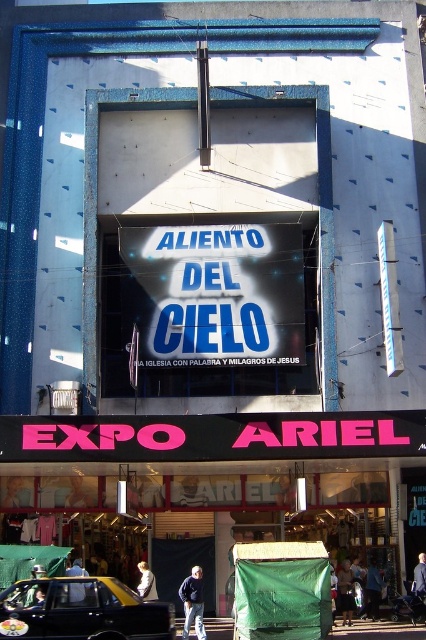
You are standing on the sidewalk in front of the building and see the black matte taxi at lower left and the blue fabric at center. Which object is nearer to you?

The black matte taxi at lower left is closer to you than the blue fabric at center.

You are standing in front of the building and want to place a new sign between the two points, point (150, 616) and point (189, 579). Which point should the sign be closer to in order to be more visible to people passing by?

The sign should be placed closer to point (150, 616) because it is closer to the viewer, making it more visible to people passing by.